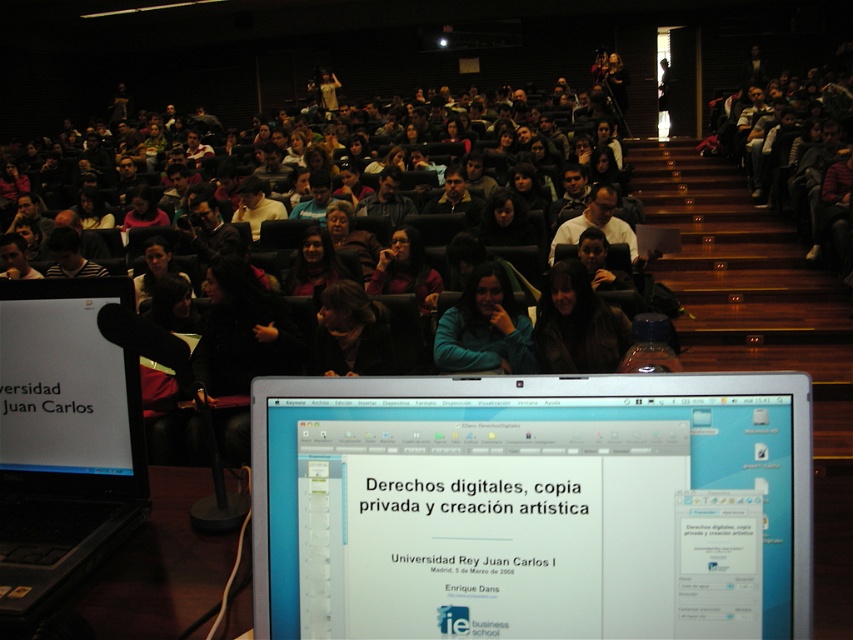
You are a photographer in the lecture hall and want to take a photo of the silver metallic laptop at center and the dark brown fur coat at center. Since the lighting is dim, you need to adjust your camera settings. Considering their positions, which object should you focus on first to ensure both are in sharp focus?

The silver metallic laptop at center is in front of the dark brown fur coat at center. To ensure both are in sharp focus, you should focus on the dark brown fur coat at center because it is further away, allowing the depth of field to cover both objects.

You are an attendee at the lecture hall and notice two people sitting in front of you. One is wearing a teal fleece jacket at center and the other has matte black hair at center. If you want to see the presentation slide on the right, which person might block your view more due to their height?

The teal fleece jacket at center has a greater height compared to matte black hair at center, so the person wearing the teal fleece jacket at center would block your view more.

You are organizing a tech conference and need to place a 12 inch wide tablet between the silver metallic laptop at center and the dark brown fur coat at center. Based on their widths, can the tablet fit between them without overlapping either item?

The silver metallic laptop at center is wider than the dark brown fur coat at center. Since the tablet is 12 inches wide, it can fit between them as long as the combined width of the two items allows for the tablet to be placed in between without overlapping. However, the exact placement depends on the specific widths of both items.